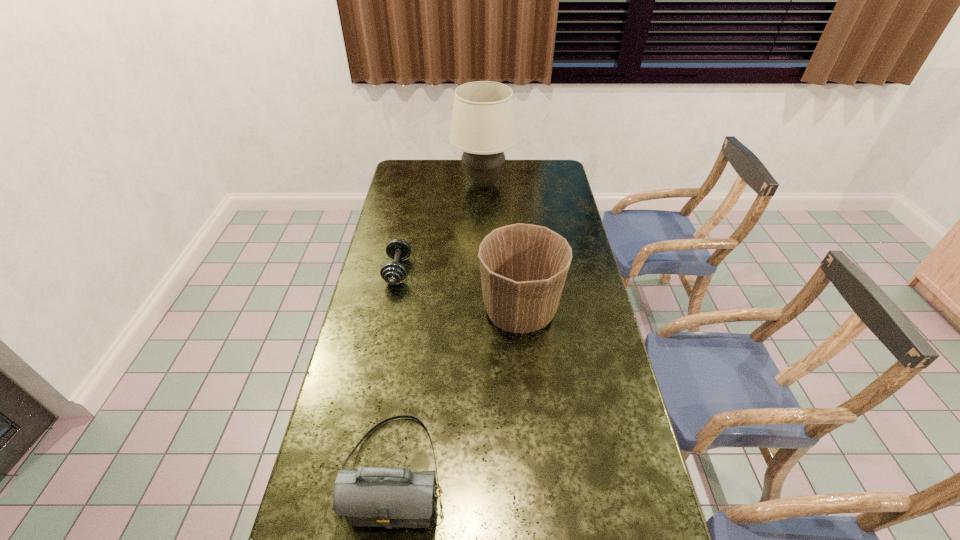
The width and height of the screenshot is (960, 540). In order to click on the farthest object in this screenshot , I will do `click(483, 125)`.

I want to click on the tallest object, so (483, 125).

Where is `flowerpot`? flowerpot is located at coordinates (523, 267).

Identify the location of the nearest object. The image size is (960, 540). (386, 497).

Where is `shoulder bag`? The height and width of the screenshot is (540, 960). shoulder bag is located at coordinates (386, 497).

Find the location of `dumbbell`. dumbbell is located at coordinates (393, 273).

At what (x,y) coordinates should I click in order to perform the action: click on vacant space located 0.070m on the back of the tallest object. Please return your answer as a coordinate pair (x, y). Looking at the image, I should click on (483, 161).

This screenshot has width=960, height=540. In order to click on vacant space located 0.130m on the back of the flowerpot in this screenshot , I will do `click(516, 259)`.

What are the coordinates of `vacant space located 0.370m on the right of the third tallest object` in the screenshot? It's located at (599, 471).

Find the location of a particular element. Image resolution: width=960 pixels, height=540 pixels. free space located on the front of the shortest object is located at coordinates (377, 372).